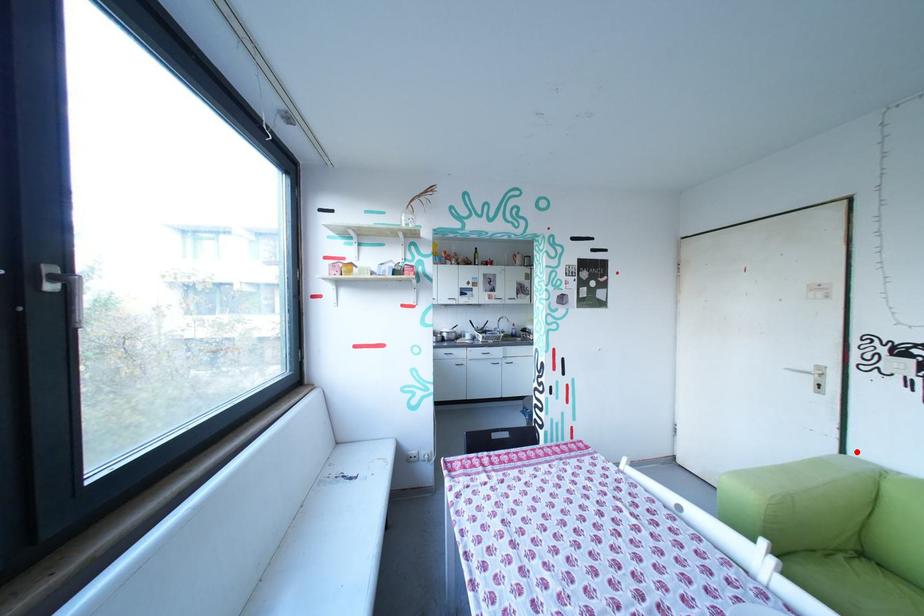
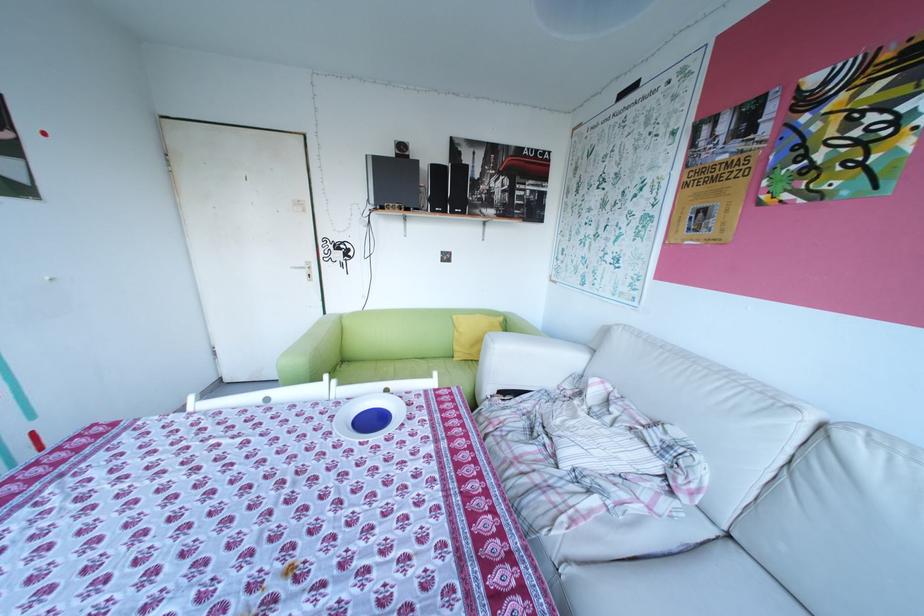
In the second image, find the point that corresponds to the highlighted location in the first image.

(337, 313)